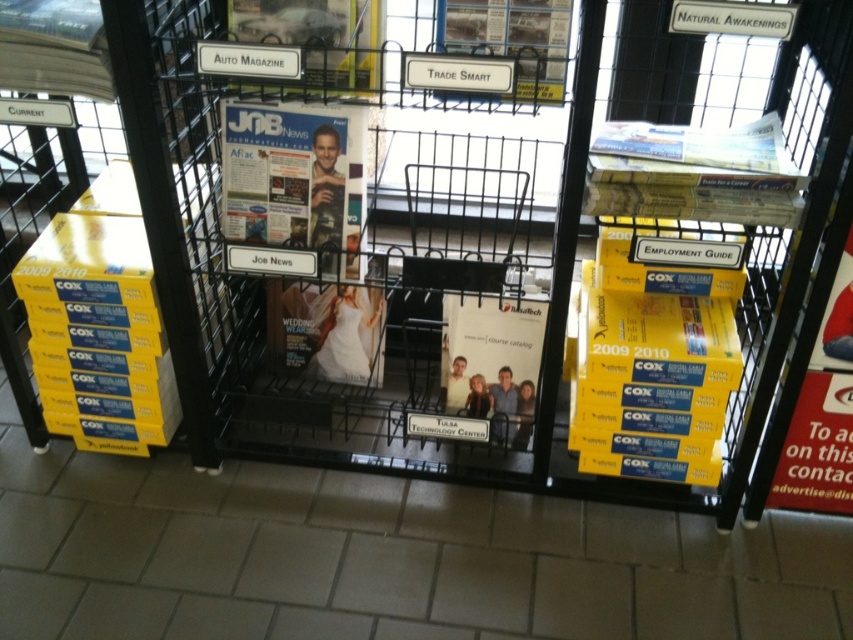
Question: Among these points, which one is farthest from the camera?

Choices:
 (A) (514, 314)
 (B) (293, 180)

Answer: (A)

Question: Does matte paper magazine at center appear on the right side of white paper at center?

Choices:
 (A) no
 (B) yes

Answer: (A)

Question: Is matte paper magazine at center wider than white paper at center?

Choices:
 (A) yes
 (B) no

Answer: (A)

Question: Does matte paper magazine at center appear over white paper at center?

Choices:
 (A) no
 (B) yes

Answer: (B)

Question: Which object appears closest to the camera in this image?

Choices:
 (A) matte paper magazine at center
 (B) white paper at center

Answer: (A)